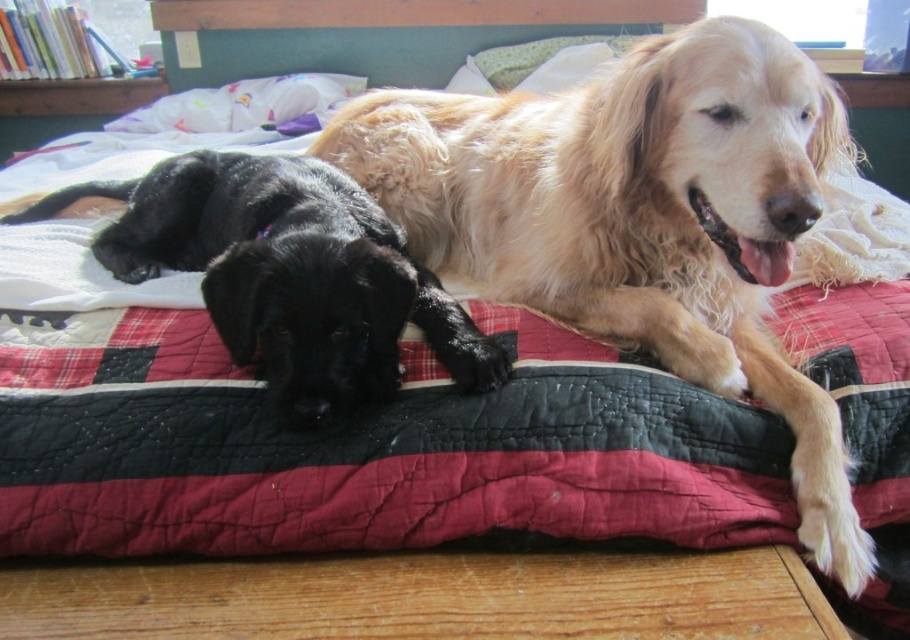
Question: Which point is farther to the camera?

Choices:
 (A) black shiny fur at center
 (B) golden fur dog at upper center

Answer: (A)

Question: Is golden fur dog at upper center positioned before black shiny fur at center?

Choices:
 (A) no
 (B) yes

Answer: (B)

Question: Which object appears farthest from the camera in this image?

Choices:
 (A) black shiny fur at center
 (B) golden fur dog at upper center

Answer: (A)

Question: Does golden fur dog at upper center appear over black shiny fur at center?

Choices:
 (A) no
 (B) yes

Answer: (B)

Question: Does golden fur dog at upper center appear over black shiny fur at center?

Choices:
 (A) no
 (B) yes

Answer: (B)

Question: Which of the following is the closest to the observer?

Choices:
 (A) golden fur dog at upper center
 (B) black shiny fur at center

Answer: (A)